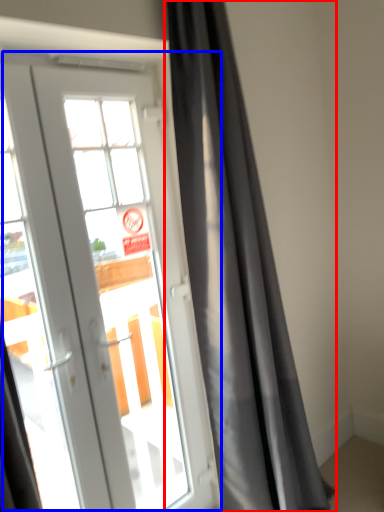
Question: Which of the following is the closest to the observer, curtain (highlighted by a red box) or door (highlighted by a blue box)?

Choices:
 (A) curtain
 (B) door

Answer: (B)